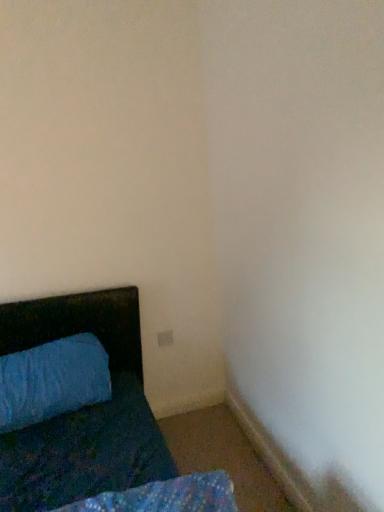
At what (x,y) coordinates should I click in order to perform the action: click on blue cotton pillow at lower left. Please return your answer as a coordinate pair (x, y). Looking at the image, I should click on (52, 380).

Measure the distance between blue cotton pillow at lower left and camera.

The depth of blue cotton pillow at lower left is 1.74 meters.

Describe the element at coordinates (52, 380) in the screenshot. I see `blue cotton pillow at lower left` at that location.

Where is `blue cotton pillow at lower left`? The image size is (384, 512). blue cotton pillow at lower left is located at coordinates (52, 380).